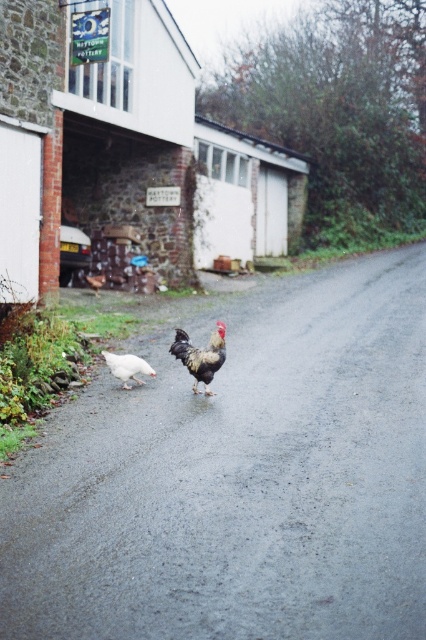
Question: From the image, what is the correct spatial relationship of black glossy rooster at center in relation to white matte chicken at lower left?

Choices:
 (A) left
 (B) right

Answer: (B)

Question: Among these objects, which one is farthest from the camera?

Choices:
 (A) black glossy rooster at center
 (B) white matte chicken at lower left

Answer: (B)

Question: Does black glossy rooster at center have a smaller size compared to white matte chicken at lower left?

Choices:
 (A) no
 (B) yes

Answer: (A)

Question: Is black glossy rooster at center behind white matte chicken at lower left?

Choices:
 (A) yes
 (B) no

Answer: (B)